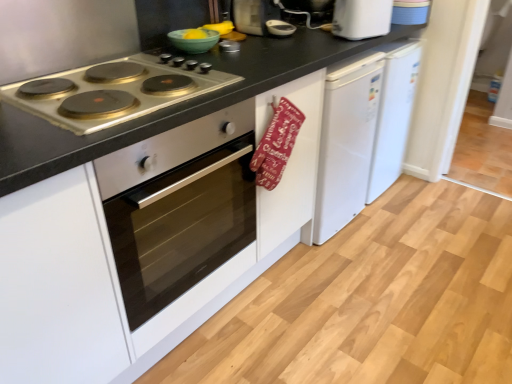
The width and height of the screenshot is (512, 384). Identify the location of vacant area that is in front of green matte bowl at upper center. (211, 59).